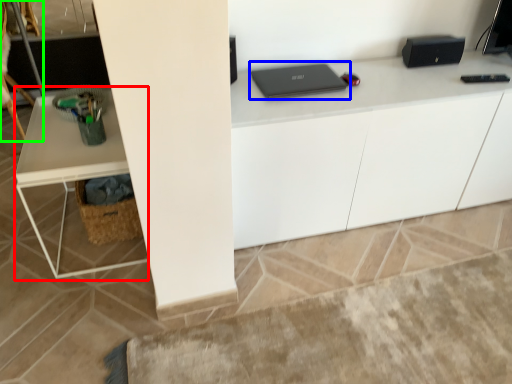
Question: Which object is the closest to the computer desk (highlighted by a red box)? Choose among these: laptop (highlighted by a blue box) or swivel chair (highlighted by a green box).

Choices:
 (A) laptop
 (B) swivel chair

Answer: (A)